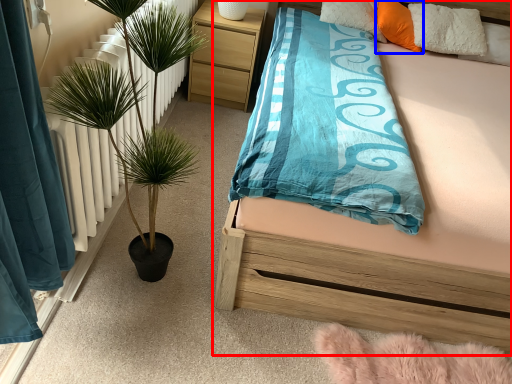
Question: Which object appears closest to the camera in this image, bed (highlighted by a red box) or pillow (highlighted by a blue box)?

Choices:
 (A) bed
 (B) pillow

Answer: (A)